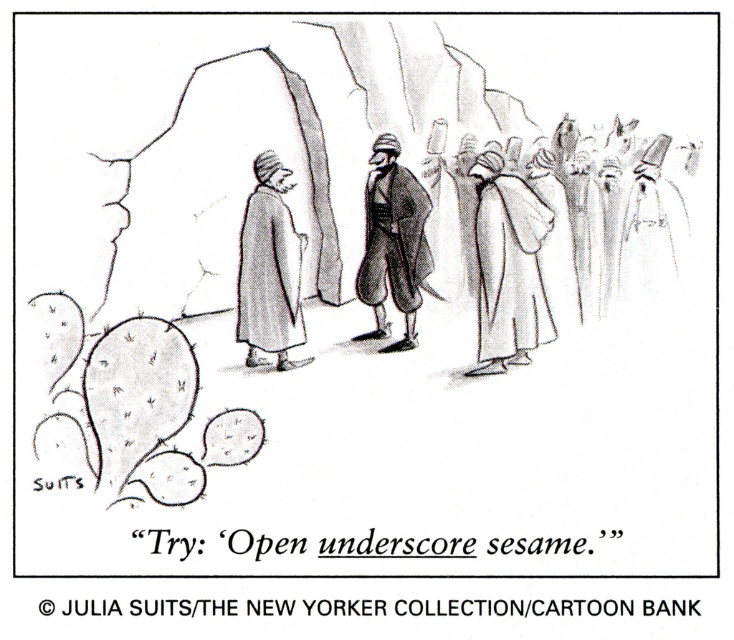
Between white matte robe at center and white cotton robe at center, which one is positioned lower?

Positioned lower is white matte robe at center.

Does point (530, 200) come farther from viewer compared to point (280, 276)?

That is False.

I want to click on white matte robe at center, so click(509, 268).

Identify the location of white matte robe at center. The image size is (734, 640). (509, 268).

Which of these two, white cotton robe at center or smooth white robe at center, stands taller?

Standing taller between the two is white cotton robe at center.

Does white cotton robe at center have a greater width compared to smooth white robe at center?

Correct, the width of white cotton robe at center exceeds that of smooth white robe at center.

Does point (302, 330) lie behind point (650, 244)?

That is False.

At what (x,y) coordinates should I click in order to perform the action: click on white cotton robe at center. Please return your answer as a coordinate pair (x, y). Looking at the image, I should click on (269, 275).

Which is above, matte brown robe at center or smooth white robe at center?

Positioned higher is matte brown robe at center.

Does matte brown robe at center have a greater width compared to smooth white robe at center?

Correct, the width of matte brown robe at center exceeds that of smooth white robe at center.

This screenshot has width=734, height=640. What do you see at coordinates (393, 237) in the screenshot? I see `matte brown robe at center` at bounding box center [393, 237].

At what (x,y) coordinates should I click in order to perform the action: click on matte brown robe at center. Please return your answer as a coordinate pair (x, y). This screenshot has height=640, width=734. Looking at the image, I should click on (393, 237).